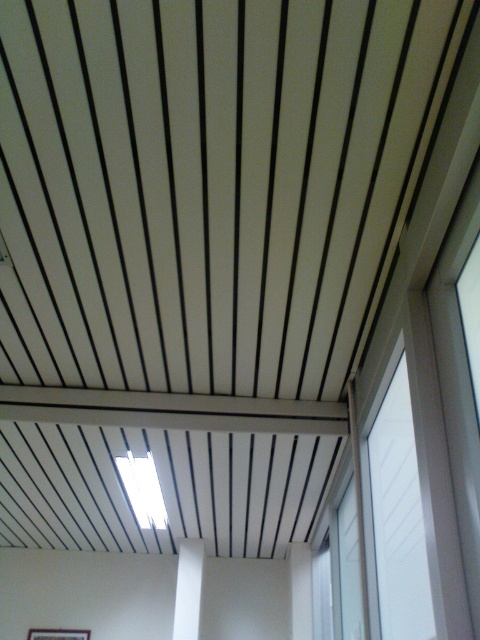
You are an interior designer planning to install a new light fixture. You have two options for placement locations. One is near the white glossy window at right, and the other is near the white matte pillar at center. Which location would you choose if you want the light to reach higher up in the ceiling?

The white glossy window at right is much taller than the white matte pillar at center, so placing the light fixture near the white glossy window at right would allow the light to reach higher up in the ceiling.

You are standing in the room depicted in the image. You want to move to the window to let in more light. Which direction should you move relative to your current position facing the white glossy window at right?

Since the white glossy window at right is located at coordinates approximately 0.811 on the x and 0.823 on the y axis, you should move towards the right and slightly forward to reach it.